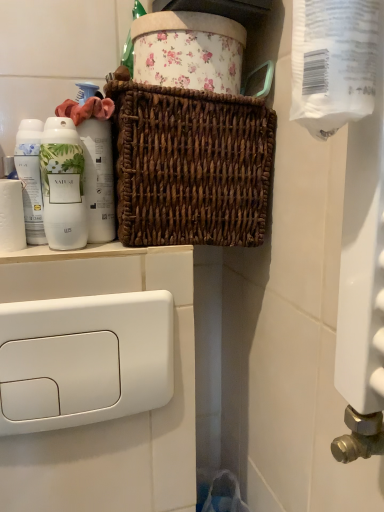
Question: From a real-world perspective, is white glossy bottle at left located beneath brown woven basket at center?

Choices:
 (A) no
 (B) yes

Answer: (B)

Question: Does white glossy bottle at left lie in front of brown woven basket at center?

Choices:
 (A) yes
 (B) no

Answer: (B)

Question: Is white glossy bottle at left at the right side of brown woven basket at center?

Choices:
 (A) no
 (B) yes

Answer: (A)

Question: Considering the relative sizes of white glossy bottle at left and brown woven basket at center in the image provided, is white glossy bottle at left bigger than brown woven basket at center?

Choices:
 (A) no
 (B) yes

Answer: (A)

Question: Is the depth of white glossy bottle at left greater than that of brown woven basket at center?

Choices:
 (A) yes
 (B) no

Answer: (A)

Question: Does white glossy bottle at left have a lesser width compared to brown woven basket at center?

Choices:
 (A) no
 (B) yes

Answer: (B)

Question: From the image's perspective, is brown woven basket at center below white glossy bottle at left?

Choices:
 (A) yes
 (B) no

Answer: (B)

Question: Is brown woven basket at center outside white glossy bottle at left?

Choices:
 (A) no
 (B) yes

Answer: (B)

Question: Does brown woven basket at center have a greater height compared to white glossy bottle at left?

Choices:
 (A) no
 (B) yes

Answer: (B)

Question: Considering the relative sizes of brown woven basket at center and white glossy bottle at left in the image provided, is brown woven basket at center bigger than white glossy bottle at left?

Choices:
 (A) no
 (B) yes

Answer: (B)

Question: From the image's perspective, is brown woven basket at center over white glossy bottle at left?

Choices:
 (A) no
 (B) yes

Answer: (B)

Question: Is brown woven basket at center positioned with its back to white glossy bottle at left?

Choices:
 (A) no
 (B) yes

Answer: (A)

Question: Is white matte bottle at left not close to white glossy bottle at left?

Choices:
 (A) yes
 (B) no

Answer: (B)